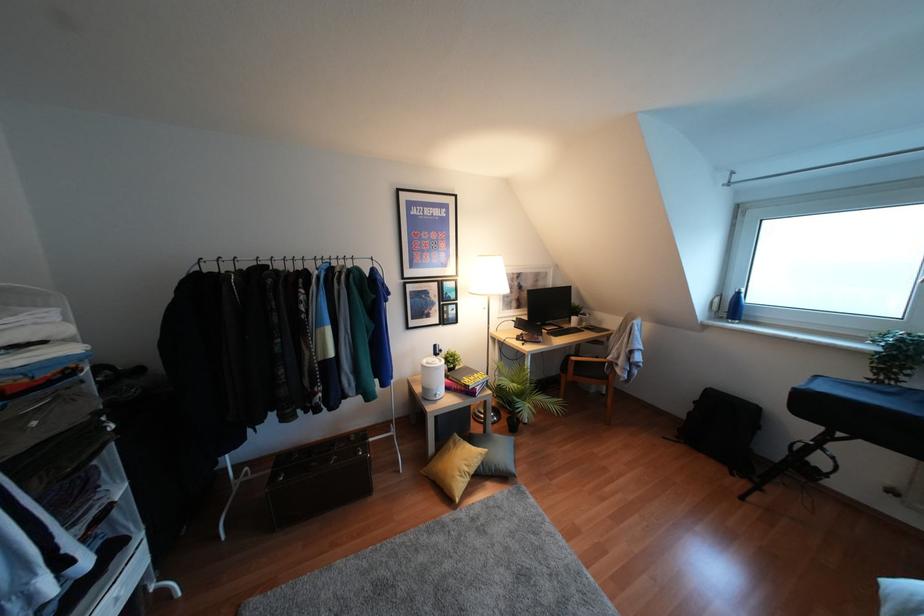
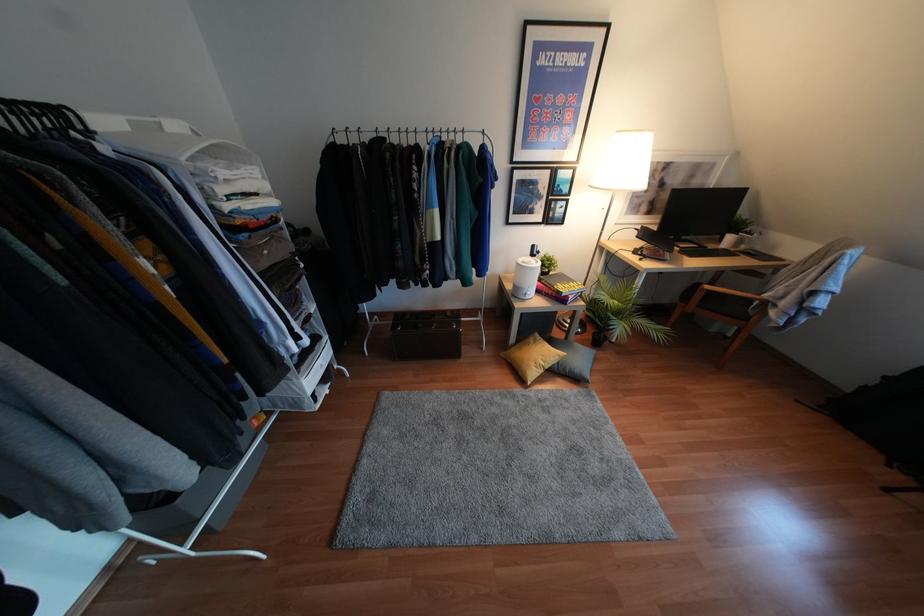
Locate, in the second image, the point that corresponds to [604,378] in the first image.

(745, 318)